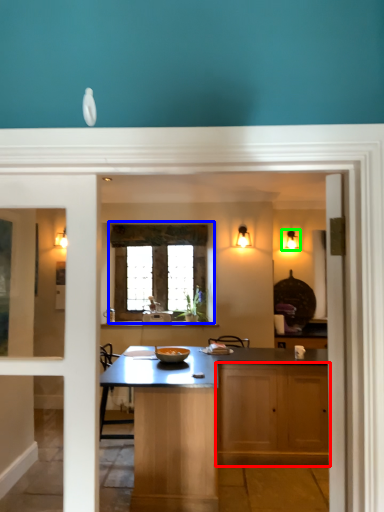
Question: Estimate the real-world distances between objects in this image. Which object is closer to cabinetry (highlighted by a red box), window (highlighted by a blue box) or light fixture (highlighted by a green box)?

Choices:
 (A) window
 (B) light fixture

Answer: (A)